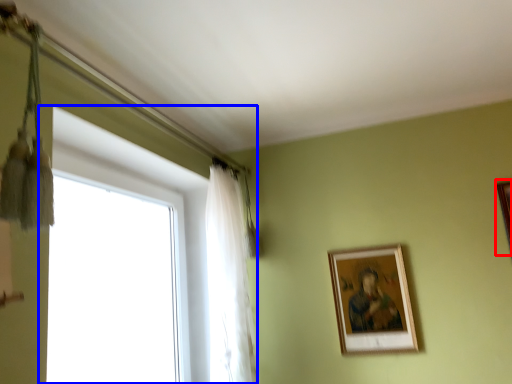
Question: Which point is further to the camera, picture frame (highlighted by a red box) or window (highlighted by a blue box)?

Choices:
 (A) picture frame
 (B) window

Answer: (A)